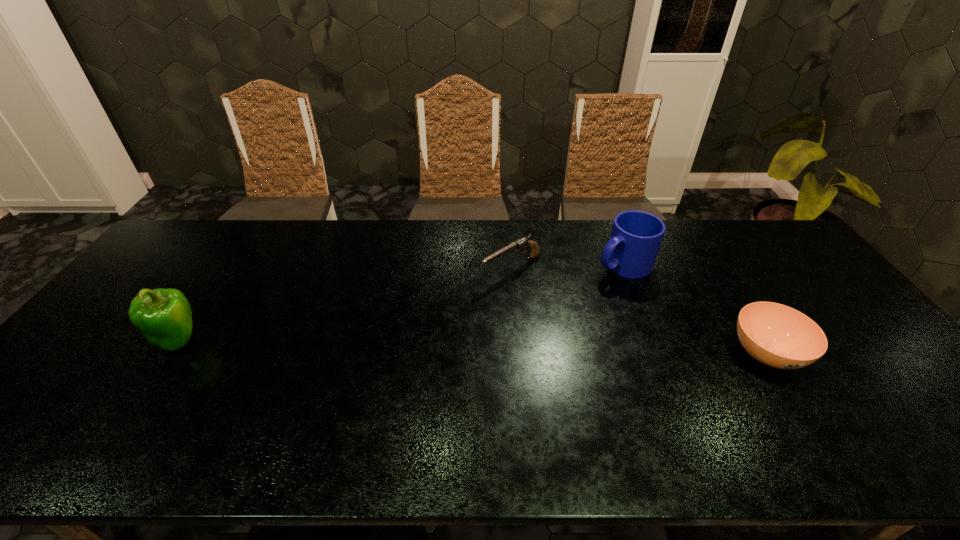
This screenshot has width=960, height=540. I want to click on blank space at the far left corner, so click(213, 230).

The image size is (960, 540). I want to click on vacant point located between the leftmost object and the second object from left to right, so click(345, 305).

I want to click on free area in between the second tallest object and the gun, so click(x=567, y=267).

I want to click on free space between the second object from left to right and the second tallest object, so pos(567,267).

Where is `free space between the third object from left to right and the third object from right to left`? The width and height of the screenshot is (960, 540). free space between the third object from left to right and the third object from right to left is located at coordinates (567, 267).

The width and height of the screenshot is (960, 540). I want to click on unoccupied area between the third shortest object and the leftmost object, so [400, 302].

Where is `empty space that is in between the soup bowl and the second tallest object`? empty space that is in between the soup bowl and the second tallest object is located at coordinates (694, 309).

This screenshot has height=540, width=960. What are the coordinates of `empty space that is in between the third object from right to left and the second tallest object` in the screenshot? It's located at (567, 267).

Image resolution: width=960 pixels, height=540 pixels. I want to click on vacant space that is in between the second object from left to right and the third shortest object, so click(x=567, y=267).

The width and height of the screenshot is (960, 540). In order to click on free space between the mug and the rightmost object in this screenshot , I will do `click(694, 309)`.